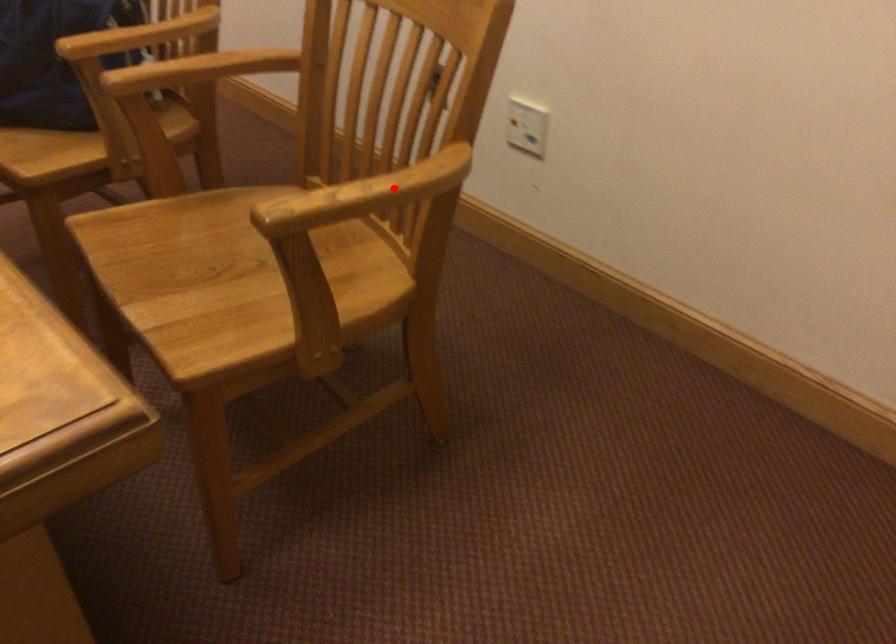
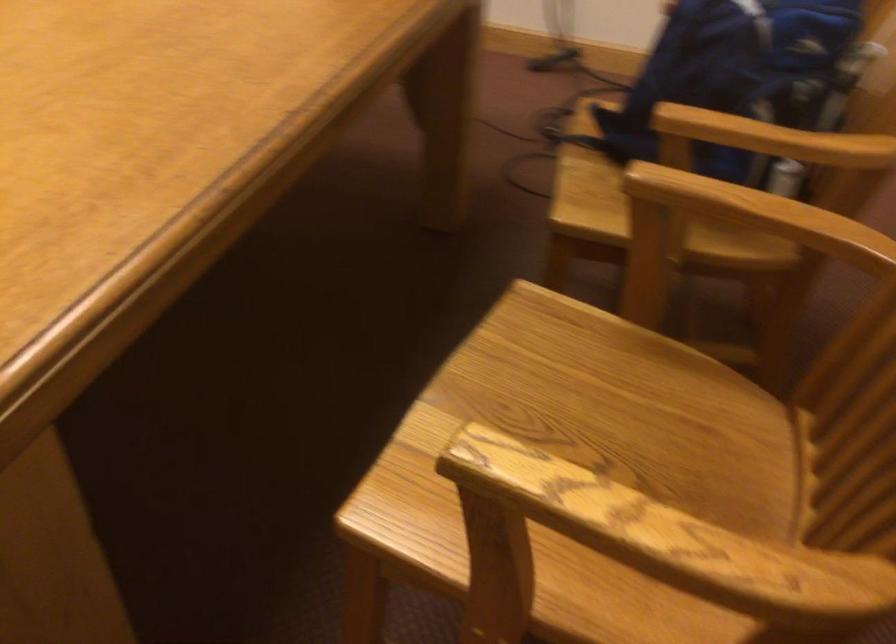
Where in the second image is the point corresponding to the highlighted location from the first image?

(658, 542)